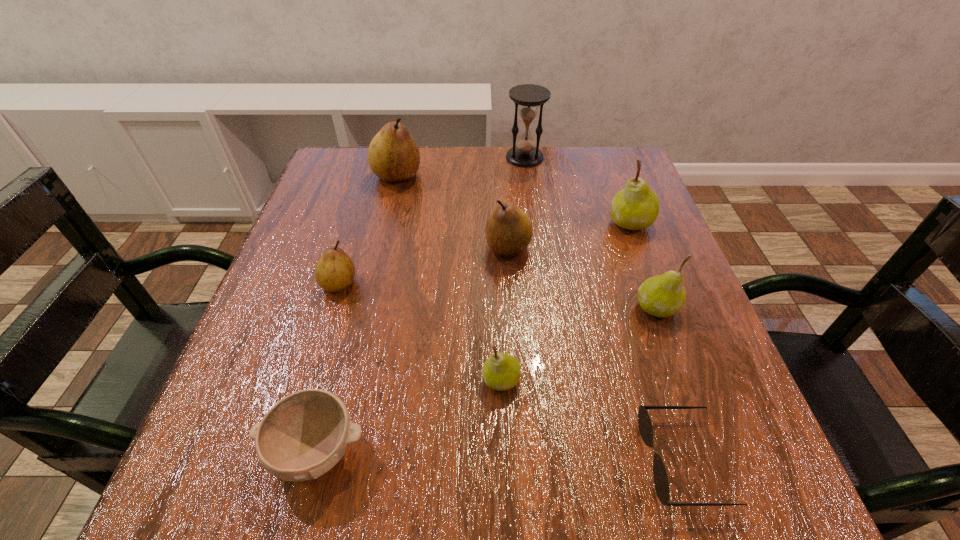
Where is `pear that is the third closest to the rightmost brown pear`? pear that is the third closest to the rightmost brown pear is located at coordinates (393, 155).

Identify the location of pear that stands as the sixth closest to the sunglasses. (393, 155).

Select which brown pear appears as the closest to the hourglass. Please provide its 2D coordinates. Your answer should be formatted as a tuple, i.e. [(x, y)], where the tuple contains the x and y coordinates of a point satisfying the conditions above.

[(393, 155)]

Locate an element on the screen. This screenshot has height=540, width=960. brown pear that is the third closest to the eighth tallest object is located at coordinates (393, 155).

The height and width of the screenshot is (540, 960). I want to click on the third closest green pear to the biggest brown pear, so click(664, 295).

At what (x,y) coordinates should I click in order to perform the action: click on green pear that stands as the third closest to the hourglass. Please return your answer as a coordinate pair (x, y). The image size is (960, 540). Looking at the image, I should click on (501, 371).

Image resolution: width=960 pixels, height=540 pixels. Find the location of `free space that satisfies the following two spatial constraints: 1. on the back side of the farthest pear; 2. on the right side of the hourglass`. free space that satisfies the following two spatial constraints: 1. on the back side of the farthest pear; 2. on the right side of the hourglass is located at coordinates (401, 158).